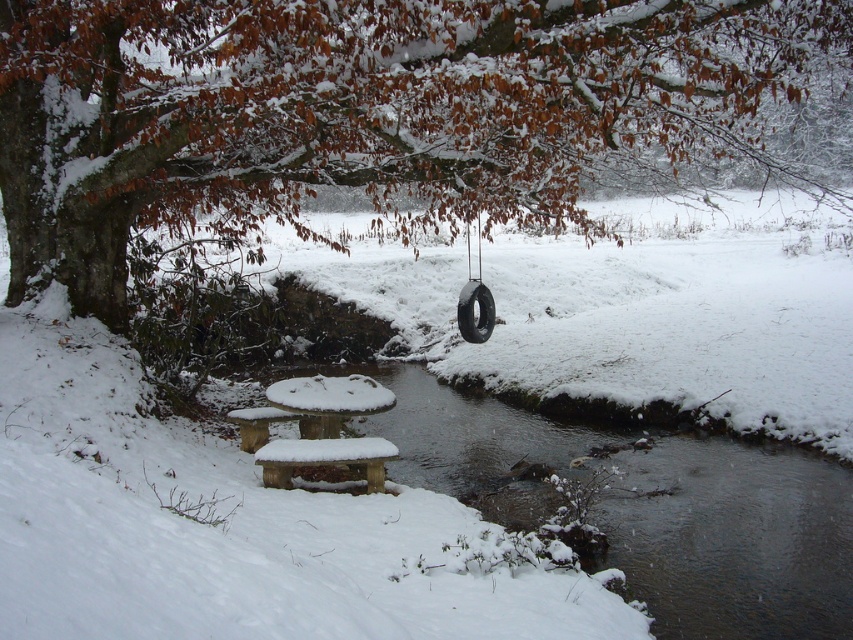
Question: Which of the following is the closest to the observer?

Choices:
 (A) snow-covered wood picnic table at lower center
 (B) snow-covered wooden stream at lower center
 (C) black rubber tire at center

Answer: (B)

Question: Can you confirm if snow-covered wood picnic table at lower center is bigger than black rubber tire at center?

Choices:
 (A) no
 (B) yes

Answer: (B)

Question: Which point is closer to the camera taking this photo?

Choices:
 (A) (477, 330)
 (B) (35, 99)

Answer: (B)

Question: Does snow-covered wooden stream at lower center appear over black rubber tire at center?

Choices:
 (A) no
 (B) yes

Answer: (A)

Question: Based on their relative distances, which object is farther from the snow-covered wood picnic table at lower center?

Choices:
 (A) snow-covered wooden stream at lower center
 (B) snow-covered tree at upper left

Answer: (B)

Question: Is snow-covered wooden stream at lower center closer to camera compared to snow-covered wood picnic table at lower center?

Choices:
 (A) yes
 (B) no

Answer: (A)